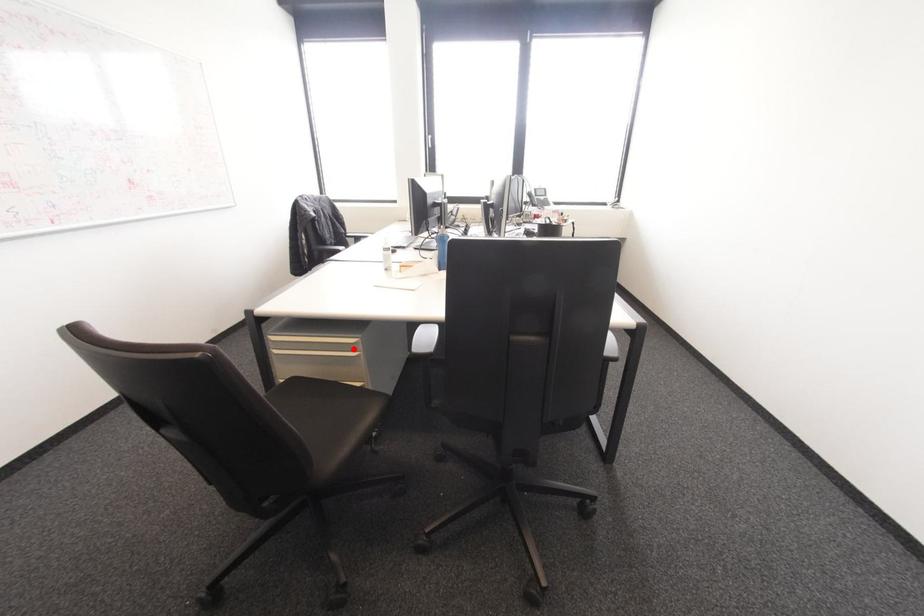
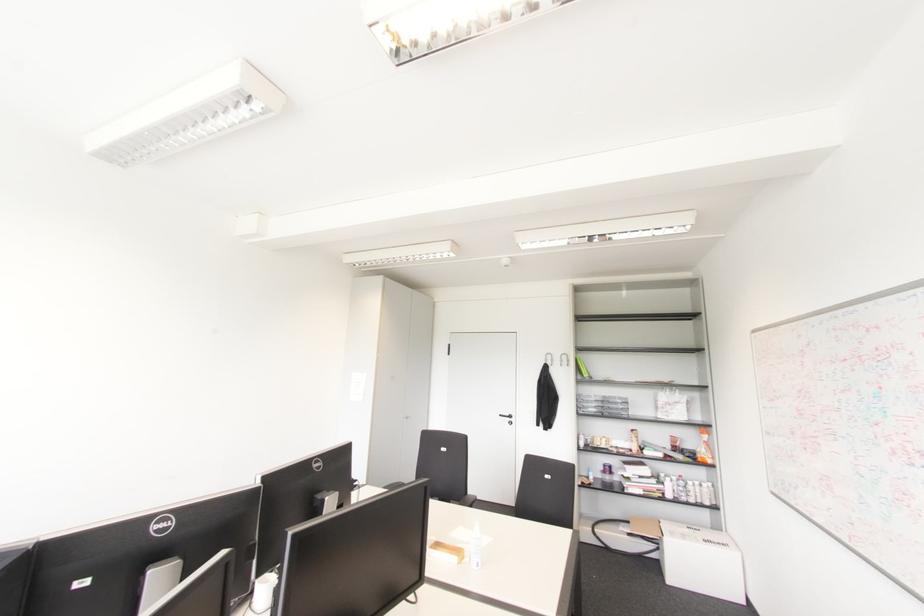
Question: I am providing you with two images of the same scene from different viewpoints. A red point is marked on the first image. At the location where the point appears in image 1, is it still visible in image 2?

Choices:
 (A) Yes
 (B) No

Answer: (B)